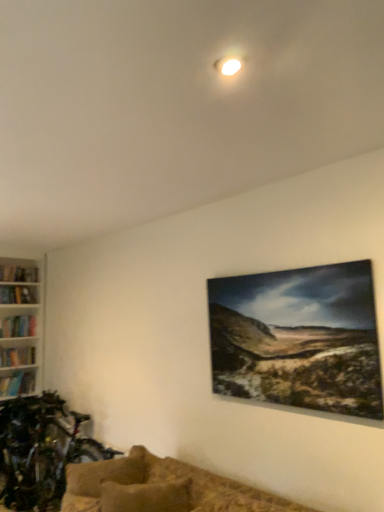
Describe the element at coordinates (146, 497) in the screenshot. I see `textured beige pillow at lower center` at that location.

At what (x,y) coordinates should I click in order to perform the action: click on brown textured couch at lower center. Please return your answer as a coordinate pair (x, y). The height and width of the screenshot is (512, 384). Looking at the image, I should click on (168, 481).

Can you confirm if textured beige pillow at lower center is positioned to the left of shiny metallic bicycle at lower left?

No.

Could you tell me if textured beige pillow at lower center is turned towards shiny metallic bicycle at lower left?

No, textured beige pillow at lower center is not facing towards shiny metallic bicycle at lower left.

Where is `studio couch above the textured beige pillow at lower center (from a real-world perspective)`? This screenshot has height=512, width=384. studio couch above the textured beige pillow at lower center (from a real-world perspective) is located at coordinates (168, 481).

Measure the distance between textured beige pillow at lower center and brown textured couch at lower center.

They are 7.52 inches apart.

Is point (101, 507) positioned before point (125, 477)?

Yes, point (101, 507) is closer to viewer.

From the picture: Is textured beige pillow at lower center to the left of brown textured couch at lower center from the viewer's perspective?

No.

Choose the correct answer: Is shiny metallic bicycle at lower left inside brown textured couch at lower center or outside it?

shiny metallic bicycle at lower left is outside brown textured couch at lower center.

Based on the photo, which of these two, shiny metallic bicycle at lower left or brown textured couch at lower center, stands shorter?

With less height is brown textured couch at lower center.

Based on their sizes in the image, would you say shiny metallic bicycle at lower left is bigger or smaller than brown textured couch at lower center?

shiny metallic bicycle at lower left is bigger than brown textured couch at lower center.

Consider the image. Is shiny metallic bicycle at lower left looking in the opposite direction of textured beige pillow at lower center?

No, shiny metallic bicycle at lower left's orientation is not away from textured beige pillow at lower center.

Does point (37, 438) appear closer or farther from the camera than point (153, 486)?

Point (37, 438) is positioned farther from the camera compared to point (153, 486).

How many degrees apart are the facing directions of shiny metallic bicycle at lower left and textured beige pillow at lower center?

73.1 degrees separate the facing orientations of shiny metallic bicycle at lower left and textured beige pillow at lower center.

Is shiny metallic bicycle at lower left positioned beyond the bounds of textured beige pillow at lower center?

Yes.

From the image's perspective, is brown textured couch at lower center over textured beige pillow at lower center?

Actually, brown textured couch at lower center appears below textured beige pillow at lower center in the image.

Which is closer to the camera, (217, 505) or (168, 504)?

The point (217, 505) is more forward.

Can you confirm if brown textured couch at lower center is bigger than textured beige pillow at lower center?

Yes.

Which of these two, brown textured couch at lower center or shiny metallic bicycle at lower left, is bigger?

With larger size is shiny metallic bicycle at lower left.

Which is behind, point (245, 492) or point (13, 488)?

Point (13, 488)

Find the location of a particular element. mountain bike lying below the brown textured couch at lower center (from the image's perspective) is located at coordinates click(x=40, y=451).

Based on the photo, is there a large distance between brown textured couch at lower center and shiny metallic bicycle at lower left?

Indeed, brown textured couch at lower center is not near shiny metallic bicycle at lower left.

Where is `mountain bike below the textured beige pillow at lower center (from the image's perspective)`? This screenshot has width=384, height=512. mountain bike below the textured beige pillow at lower center (from the image's perspective) is located at coordinates (40, 451).

Locate an element on the screen. The image size is (384, 512). studio couch that is above the textured beige pillow at lower center (from a real-world perspective) is located at coordinates (168, 481).

Which object lies nearer to the anchor point brown textured couch at lower center, textured beige pillow at lower center or shiny metallic bicycle at lower left?

Based on the image, textured beige pillow at lower center appears to be nearer to brown textured couch at lower center.

Based on their spatial positions, is shiny metallic bicycle at lower left or textured beige pillow at lower center further from brown textured couch at lower center?

shiny metallic bicycle at lower left is further to brown textured couch at lower center.

Considering their positions, is shiny metallic bicycle at lower left positioned further to textured beige pillow at lower center than brown textured couch at lower center?

shiny metallic bicycle at lower left.

Looking at the image, which one is located closer to textured beige pillow at lower center, brown textured couch at lower center or shiny metallic bicycle at lower left?

brown textured couch at lower center.

Consider the image. From the image, which object appears to be nearer to shiny metallic bicycle at lower left, textured beige pillow at lower center or brown textured couch at lower center?

Based on the image, brown textured couch at lower center appears to be nearer to shiny metallic bicycle at lower left.

From the image, which object appears to be nearer to shiny metallic bicycle at lower left, brown textured couch at lower center or textured beige pillow at lower center?

Among the two, brown textured couch at lower center is located nearer to shiny metallic bicycle at lower left.

This screenshot has height=512, width=384. In order to click on studio couch positioned between textured beige pillow at lower center and shiny metallic bicycle at lower left from near to far in this screenshot , I will do `click(168, 481)`.